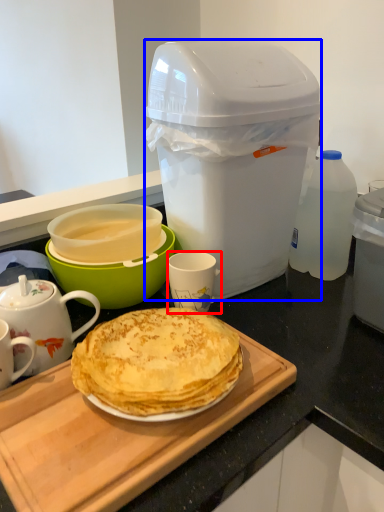
Question: Among these objects, which one is nearest to the camera, coffee cup (highlighted by a red box) or trash bin/can (highlighted by a blue box)?

Choices:
 (A) coffee cup
 (B) trash bin/can

Answer: (B)